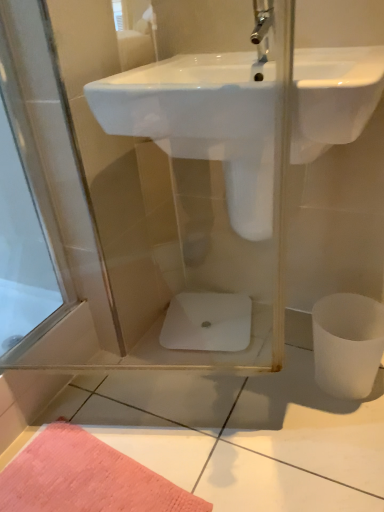
Find the location of a particular element. The width and height of the screenshot is (384, 512). blank space situated above white glossy toilet bowl at center, the first toilet bowl when ordered from back to front (from a real-world perspective) is located at coordinates (188, 315).